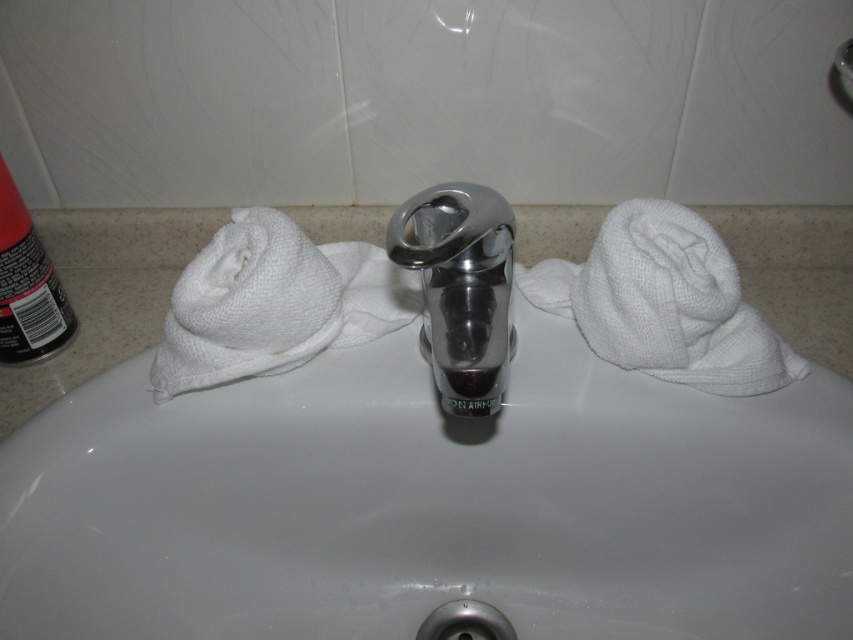
Question: Does polished chrome faucet at center have a smaller size compared to black matte can at left?

Choices:
 (A) yes
 (B) no

Answer: (B)

Question: Which object is farther from the camera taking this photo?

Choices:
 (A) black matte can at left
 (B) polished chrome faucet at center
 (C) white waffle-textured hand towel at right

Answer: (A)

Question: Does white ceramic sink at center have a smaller size compared to black matte can at left?

Choices:
 (A) no
 (B) yes

Answer: (A)

Question: Which point appears farthest from the camera in this image?

Choices:
 (A) (16, 234)
 (B) (581, 323)

Answer: (A)

Question: Can you confirm if white waffle-textured hand towel at right is bigger than polished chrome faucet at center?

Choices:
 (A) no
 (B) yes

Answer: (B)

Question: Estimate the real-world distances between objects in this image. Which object is farther from the polished chrome faucet at center?

Choices:
 (A) black matte can at left
 (B) white ceramic sink at center

Answer: (A)